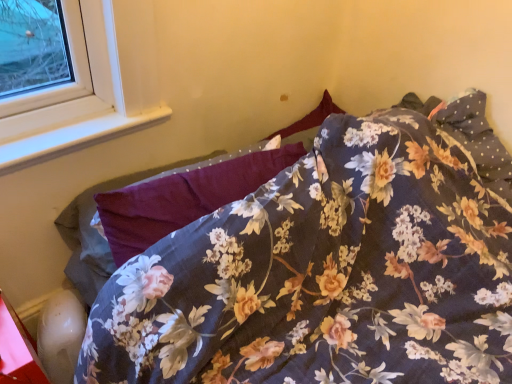
The width and height of the screenshot is (512, 384). Describe the element at coordinates (326, 273) in the screenshot. I see `floral fabric bed at center` at that location.

This screenshot has height=384, width=512. What are the coordinates of `floral fabric pillow at center` in the screenshot? It's located at (182, 198).

Which of these two, floral fabric bed at center or floral fabric pillow at center, is smaller?

With smaller size is floral fabric pillow at center.

Looking at this image, from the image's perspective, is floral fabric bed at center under floral fabric pillow at center?

Correct, floral fabric bed at center appears lower than floral fabric pillow at center in the image.

From the picture: Does floral fabric bed at center touch floral fabric pillow at center?

No, floral fabric bed at center is not touching floral fabric pillow at center.

Which object is positioned more to the left, floral fabric pillow at center or white plastic window sill at upper left?

white plastic window sill at upper left.

Is floral fabric pillow at center oriented towards white plastic window sill at upper left?

No, floral fabric pillow at center is not aimed at white plastic window sill at upper left.

Consider the image. Which of these two, floral fabric pillow at center or white plastic window sill at upper left, is thinner?

white plastic window sill at upper left.

Measure the distance between white plastic window sill at upper left and floral fabric bed at center.

white plastic window sill at upper left is 28.02 inches from floral fabric bed at center.

Looking at their sizes, would you say white plastic window sill at upper left is wider or thinner than floral fabric bed at center?

Considering their sizes, white plastic window sill at upper left looks slimmer than floral fabric bed at center.

From the image's perspective, is white plastic window sill at upper left positioned above or below floral fabric bed at center?

From the image's perspective, white plastic window sill at upper left appears above floral fabric bed at center.

Are white plastic window sill at upper left and floral fabric bed at center making contact?

No, white plastic window sill at upper left is not touching floral fabric bed at center.

From the image's perspective, does floral fabric pillow at center appear higher than floral fabric bed at center?

Correct, floral fabric pillow at center appears higher than floral fabric bed at center in the image.

Is floral fabric pillow at center placed right next to floral fabric bed at center?

They are not placed beside each other.

Can you confirm if floral fabric pillow at center is positioned to the left of floral fabric bed at center?

Correct, you'll find floral fabric pillow at center to the left of floral fabric bed at center.

From their relative heights in the image, would you say floral fabric pillow at center is taller or shorter than floral fabric bed at center?

In the image, floral fabric pillow at center appears to be shorter than floral fabric bed at center.

From the image's perspective, is floral fabric bed at center positioned above or below white plastic window sill at upper left?

Based on their image positions, floral fabric bed at center is located beneath white plastic window sill at upper left.

In the image, there is a white plastic window sill at upper left. Identify the location of bed below it (from the image's perspective). The height and width of the screenshot is (384, 512). (326, 273).

Can you see floral fabric bed at center touching white plastic window sill at upper left?

No, floral fabric bed at center is not next to white plastic window sill at upper left.

From the image's perspective, which one is positioned lower, white plastic window sill at upper left or floral fabric pillow at center?

floral fabric pillow at center, from the image's perspective.

Considering the sizes of white plastic window sill at upper left and floral fabric pillow at center in the image, is white plastic window sill at upper left taller or shorter than floral fabric pillow at center?

Clearly, white plastic window sill at upper left is shorter compared to floral fabric pillow at center.

Which object is closer to the camera, white plastic window sill at upper left or floral fabric pillow at center?

floral fabric pillow at center is closer to the camera.

Based on the photo, is white plastic window sill at upper left oriented towards floral fabric pillow at center?

Yes, white plastic window sill at upper left is turned towards floral fabric pillow at center.

The image size is (512, 384). I want to click on bed located in front of the floral fabric pillow at center, so click(326, 273).

The image size is (512, 384). I want to click on window sill located above the floral fabric pillow at center (from a real-world perspective), so click(x=73, y=137).

From the image, which object appears to be farther from white plastic window sill at upper left, floral fabric pillow at center or floral fabric bed at center?

The object further to white plastic window sill at upper left is floral fabric bed at center.

Looking at this image, which object lies nearer to the anchor point white plastic window sill at upper left, floral fabric bed at center or floral fabric pillow at center?

The object closer to white plastic window sill at upper left is floral fabric pillow at center.

When comparing their distances from floral fabric pillow at center, does white plastic window sill at upper left or floral fabric bed at center seem further?

Among the two, white plastic window sill at upper left is located further to floral fabric pillow at center.

Based on their spatial positions, is floral fabric pillow at center or white plastic window sill at upper left further from floral fabric bed at center?

Among the two, white plastic window sill at upper left is located further to floral fabric bed at center.

Looking at the image, which one is located further to floral fabric bed at center, white plastic window sill at upper left or floral fabric pillow at center?

white plastic window sill at upper left.

Estimate the real-world distances between objects in this image. Which object is further from floral fabric pillow at center, floral fabric bed at center or white plastic window sill at upper left?

white plastic window sill at upper left is further to floral fabric pillow at center.

The height and width of the screenshot is (384, 512). Find the location of `pillow between white plastic window sill at upper left and floral fabric bed at center in the horizontal direction`. pillow between white plastic window sill at upper left and floral fabric bed at center in the horizontal direction is located at coordinates (182, 198).